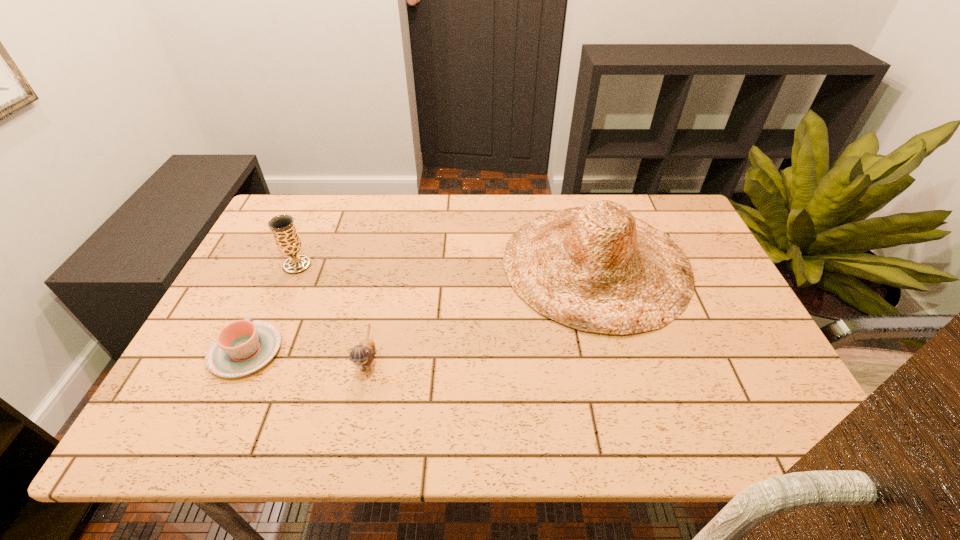
Identify the location of sunhat. The image size is (960, 540). (596, 268).

Where is `chalice`? The height and width of the screenshot is (540, 960). chalice is located at coordinates [288, 242].

Identify the location of the third object from left to right. (362, 355).

Locate an element on the screen. The image size is (960, 540). the second shortest object is located at coordinates (362, 355).

Image resolution: width=960 pixels, height=540 pixels. What are the coordinates of `chinaware` in the screenshot? It's located at (242, 347).

Where is `vacant space situated 0.400m on the left of the sunhat`? vacant space situated 0.400m on the left of the sunhat is located at coordinates (362, 264).

The height and width of the screenshot is (540, 960). I want to click on vacant region located on the front of the second tallest object, so click(x=270, y=328).

Identify the location of vacant space located on the handle side of the shortest object. (303, 228).

Identify the location of vacant position located on the handle side of the shortest object. The height and width of the screenshot is (540, 960). (300, 235).

At what (x,y) coordinates should I click in order to perform the action: click on blank space located 0.140m on the handle side of the shortest object. Please return your answer as a coordinate pair (x, y). The height and width of the screenshot is (540, 960). Looking at the image, I should click on (277, 284).